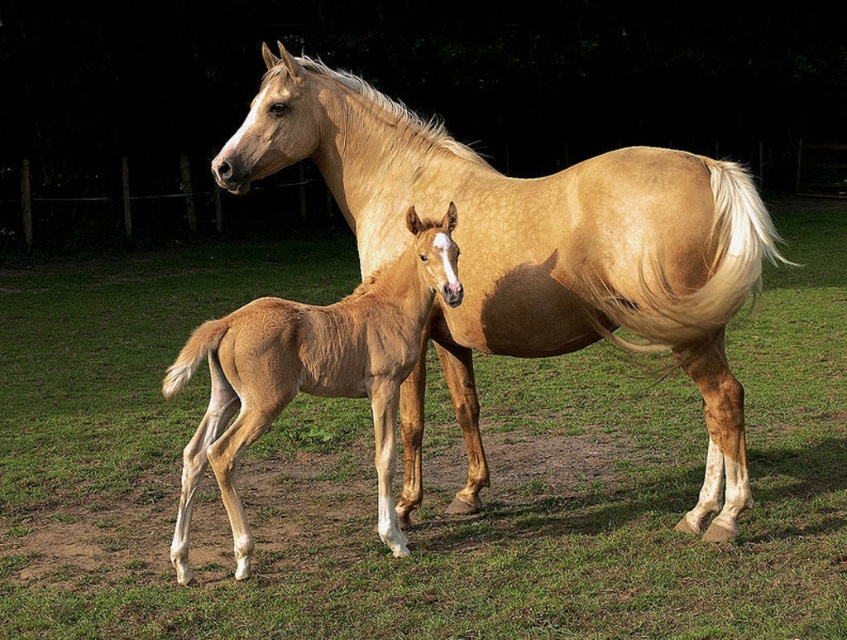
You are a photographer setting up a tripod in the middle of the scene. You want to capture both the green grass at center and the light brown glossy horse at center in your shot. Which object will appear closer to the camera in the final photo?

The light brown glossy horse at center will appear closer to the camera in the final photo because it is taller than the green grass at center, which is shorter.

You are a photographer trying to capture a closeup of the light brown glossy horse at center. You are currently positioned at the point with coordinates point (535, 248). Is this the correct location to get the best shot of the light brown glossy horse at center?

Yes, the point (535, 248) corresponds to the light brown glossy horse at center, so positioning yourself there would allow you to capture a closeup of the light brown glossy horse at center effectively.

You are a photographer standing in the field and want to take a picture of the green grass at center and the light brown glossy foal at center. Which object is nearer to you?

The green grass at center is closer to the viewer than the light brown glossy foal at center according to the description.